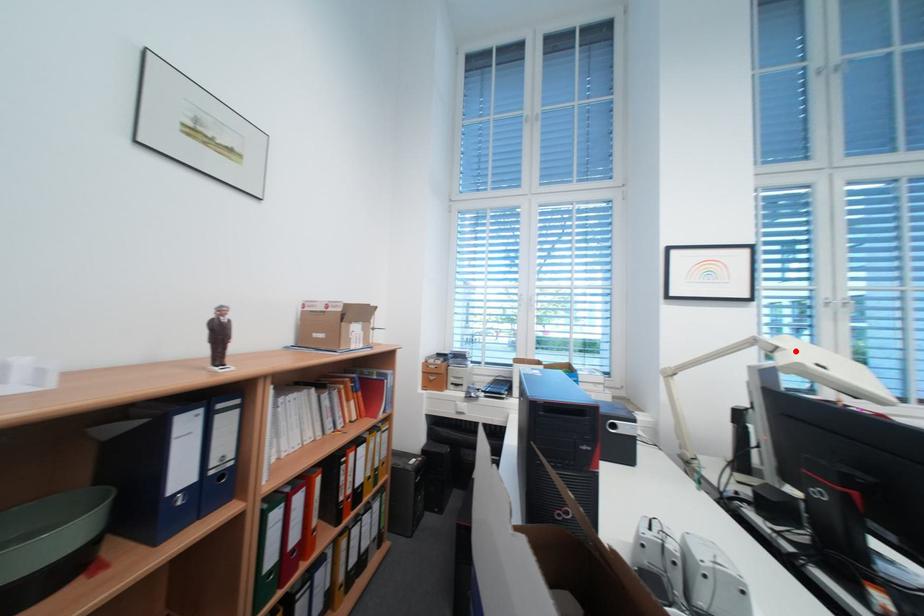
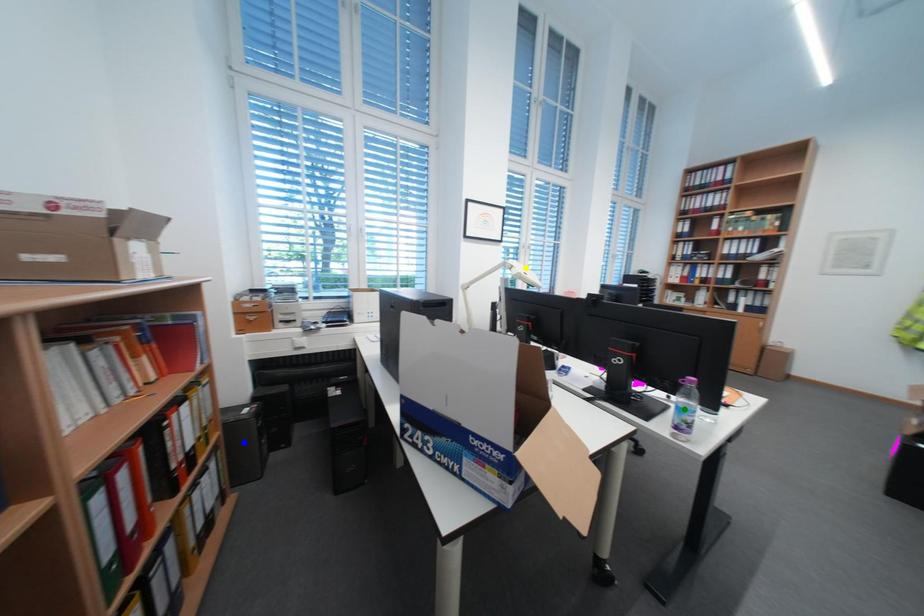
Question: I am providing you with two images of the same scene from different viewpoints. A red point is marked on the first image. You are given multiple points on the second image. Which point in image 2 represents the same 3d spot as the red point in image 1?

Choices:
 (A) blue point
 (B) green point
 (C) yellow point

Answer: (C)